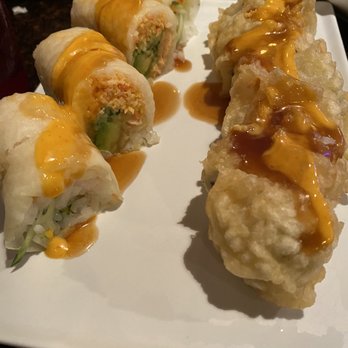
At what (x,y) coordinates should I click in order to perform the action: click on table. Please return your answer as a coordinate pair (x, y). This screenshot has width=348, height=348. Looking at the image, I should click on (41, 21).